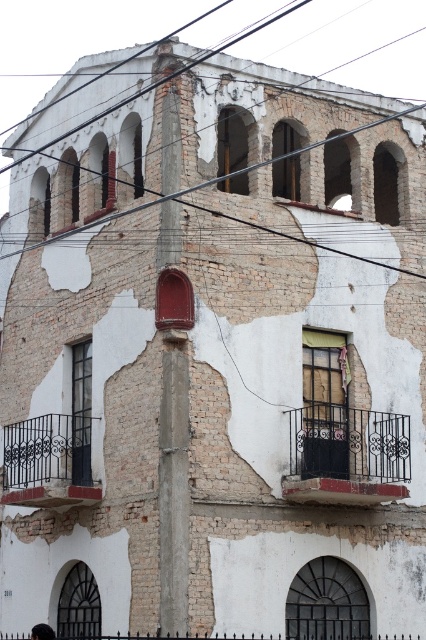
Question: Considering the relative positions of black wire at upper center and dark brown hair at lower left in the image provided, where is black wire at upper center located with respect to dark brown hair at lower left?

Choices:
 (A) right
 (B) left

Answer: (A)

Question: Observing the image, what is the correct spatial positioning of black wrought iron balcony at lower left in reference to dark brown hair at lower left?

Choices:
 (A) left
 (B) right

Answer: (B)

Question: Which point is farther from the camera taking this photo?

Choices:
 (A) (32, 636)
 (B) (141, 86)
 (C) (331, 449)
 (D) (92, 481)

Answer: (B)

Question: Is black wrought iron balcony at lower right wider than black wire at upper center?

Choices:
 (A) no
 (B) yes

Answer: (A)

Question: Which point is closer to the camera?

Choices:
 (A) (302, 451)
 (B) (46, 636)
 (C) (204, 60)
 (D) (25, 426)

Answer: (B)

Question: Which object is closer to the camera taking this photo?

Choices:
 (A) black wrought iron balcony at lower right
 (B) black wrought iron balcony at lower left
 (C) dark brown hair at lower left
 (D) black wire at upper center

Answer: (D)